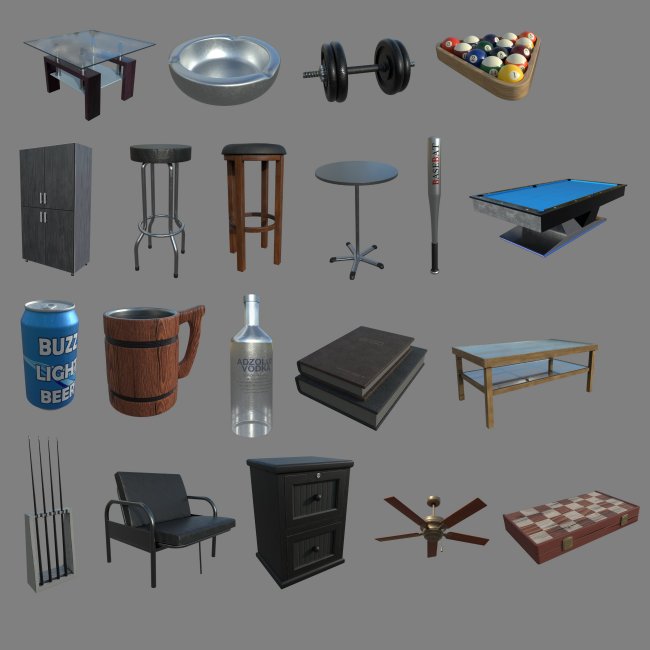
You are a GUI agent. You are given a task and a screenshot of the screen. Output one action in this format:
    pyautogui.click(x=<x>, y=<y>)
    Task: Click on the coffee table legs
    
    Given the screenshot: What is the action you would take?
    pyautogui.click(x=485, y=410), pyautogui.click(x=462, y=394), pyautogui.click(x=550, y=359), pyautogui.click(x=587, y=380)